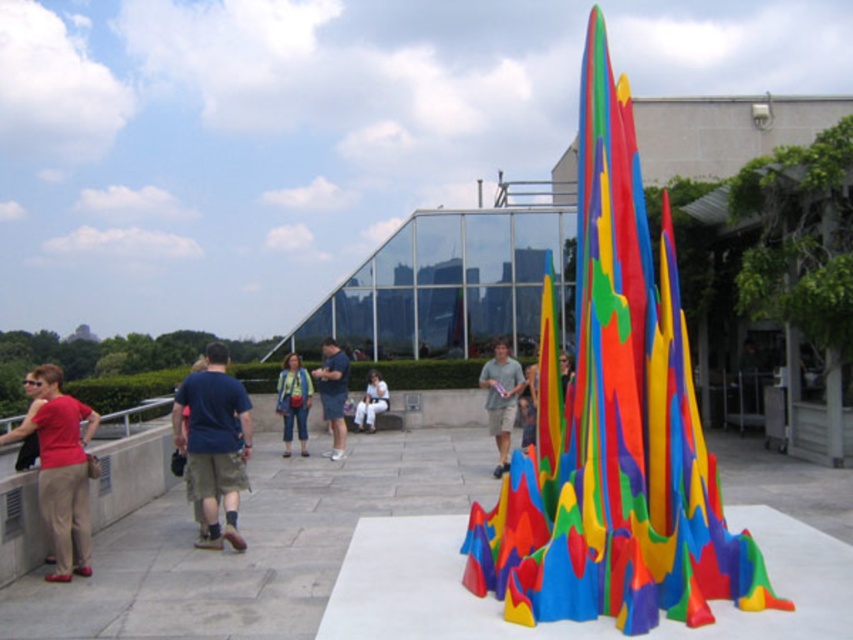
Question: Which of the following is the farthest from the observer?

Choices:
 (A) matte gray shirt at center
 (B) matte white pants at center
 (C) rubberized multicolored sculpture at center
 (D) matte red shirt at left

Answer: (B)

Question: Considering the relative positions of rubberized multicolored sculpture at center and denim pants at center in the image provided, where is rubberized multicolored sculpture at center located with respect to denim pants at center?

Choices:
 (A) above
 (B) below

Answer: (A)

Question: Is matte gray shirt at center positioned behind blue cotton shirt at center?

Choices:
 (A) yes
 (B) no

Answer: (A)

Question: Which object is farther from the camera taking this photo?

Choices:
 (A) matte gray shirt at center
 (B) blue cotton shirt at center

Answer: (A)

Question: Does matte gray shirt at center have a greater width compared to denim pants at center?

Choices:
 (A) yes
 (B) no

Answer: (B)

Question: Which of the following is the closest to the observer?

Choices:
 (A) (344, 433)
 (B) (374, 401)

Answer: (A)